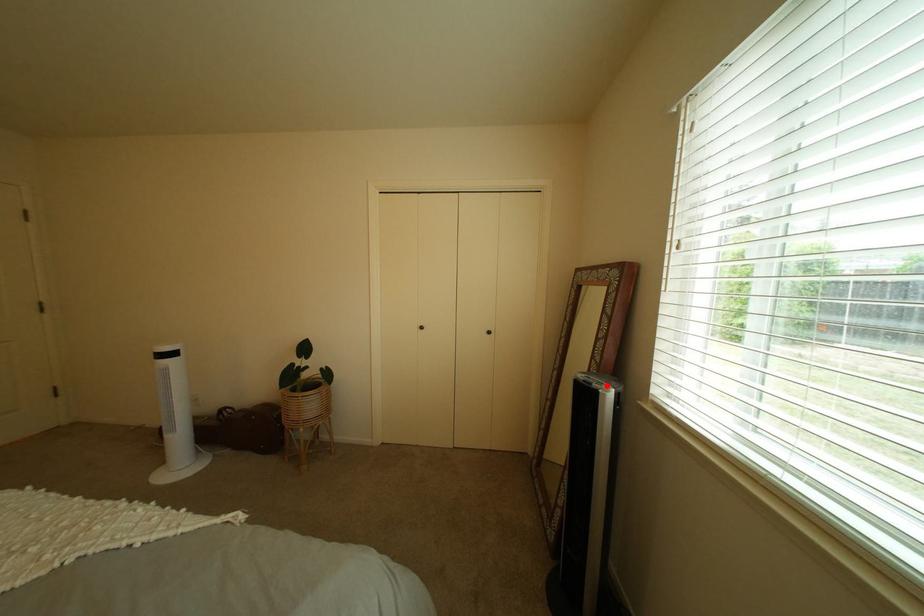
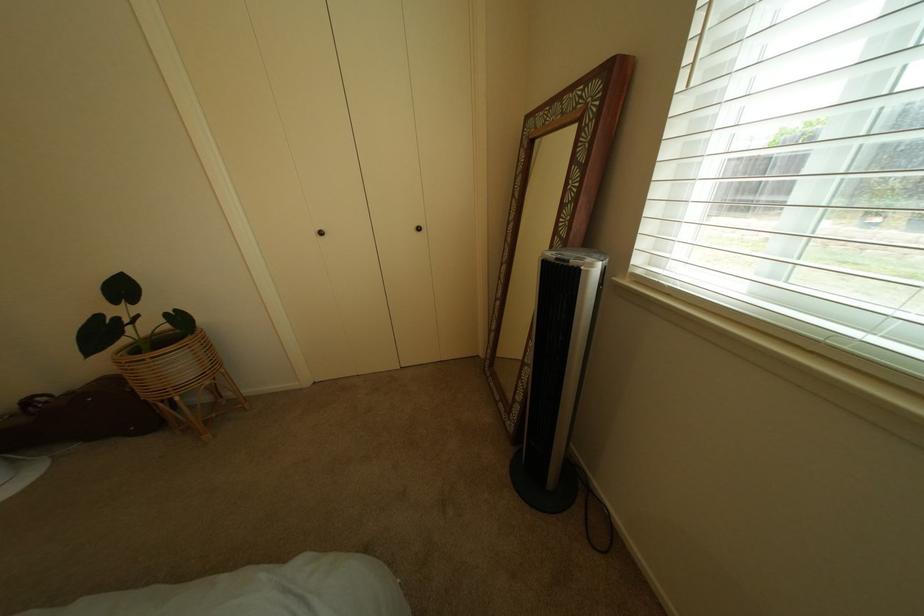
Find the pixel in the second image that matches the highlighted location in the first image.

(584, 262)